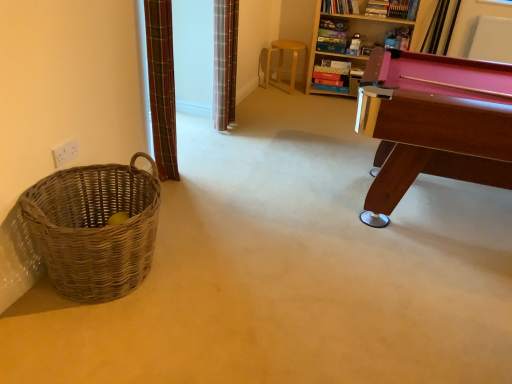
Find the location of `vacant area to the right of woven brown basket at left`. vacant area to the right of woven brown basket at left is located at coordinates (218, 284).